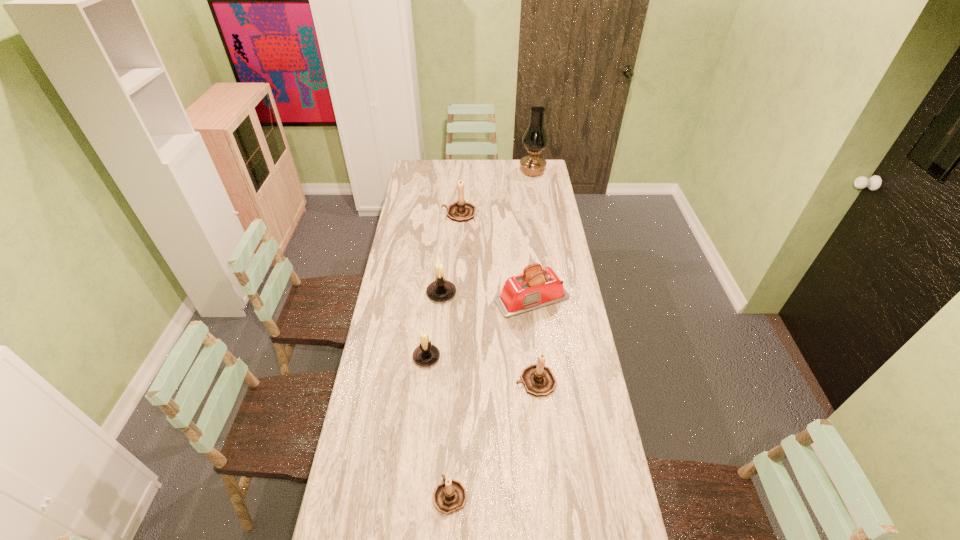
Locate an element on the screen. Image resolution: width=960 pixels, height=540 pixels. the farthest object is located at coordinates (535, 139).

Find the location of `oil lamp`. oil lamp is located at coordinates (535, 139).

Where is `the second farthest object`? the second farthest object is located at coordinates (461, 211).

The height and width of the screenshot is (540, 960). Find the location of `the farthest brown candle holder`. the farthest brown candle holder is located at coordinates (461, 211).

Where is `the bigger white candle holder`? the bigger white candle holder is located at coordinates (440, 290).

You are a GUI agent. You are given a task and a screenshot of the screen. Output one action in this format:
    pyautogui.click(x=<x>, y=<y>)
    Task: Click on the farther white candle holder
    
    Given the screenshot: What is the action you would take?
    pyautogui.click(x=440, y=290)

Where is `toaster`? toaster is located at coordinates (537, 287).

At what (x,y) coordinates should I click in order to perform the action: click on the nearer white candle holder. Please return your answer as a coordinate pair (x, y). Looking at the image, I should click on (426, 354).

You are a GUI agent. You are given a task and a screenshot of the screen. Output one action in this format:
    pyautogui.click(x=<x>, y=<y>)
    Task: Click on the rightmost brown candle holder
    
    Given the screenshot: What is the action you would take?
    pyautogui.click(x=538, y=380)

Where is `the second smallest brown candle holder`? The image size is (960, 540). the second smallest brown candle holder is located at coordinates (538, 380).